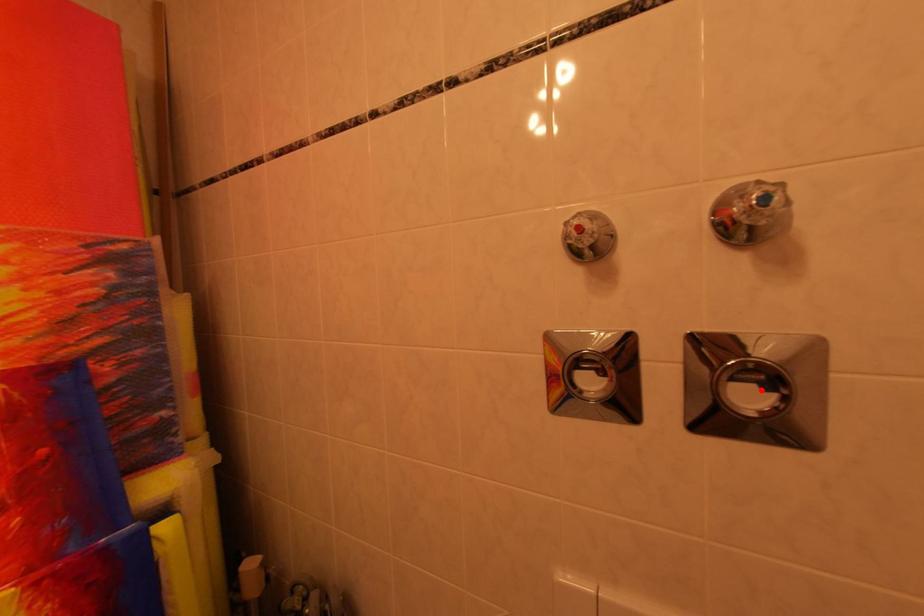
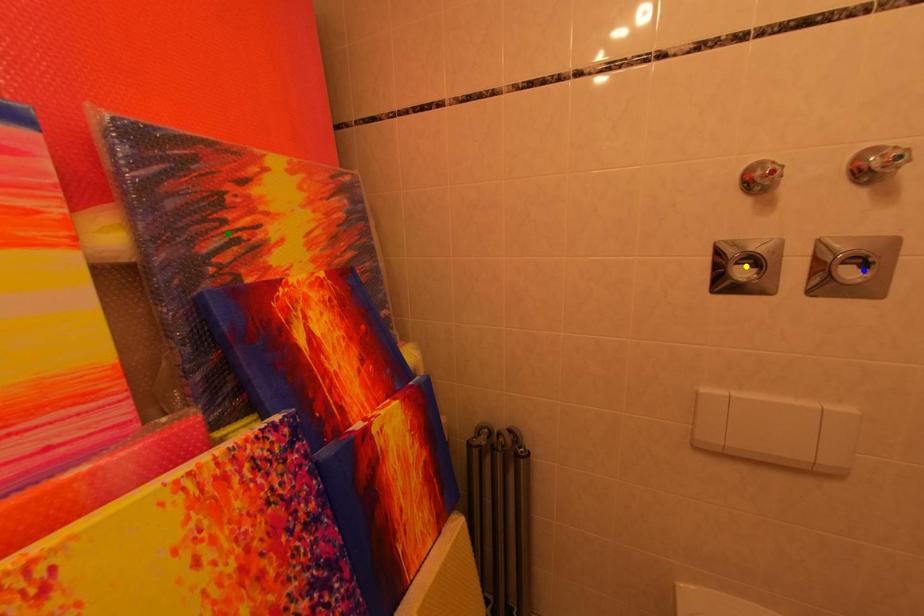
Question: I am providing you with two images of the same scene from different viewpoints. A red point is marked on the first image. You are given multiple points on the second image. Which point in image 2 is actually the same real-world point as the red point in image 1?

Choices:
 (A) yellow point
 (B) green point
 (C) blue point

Answer: (C)